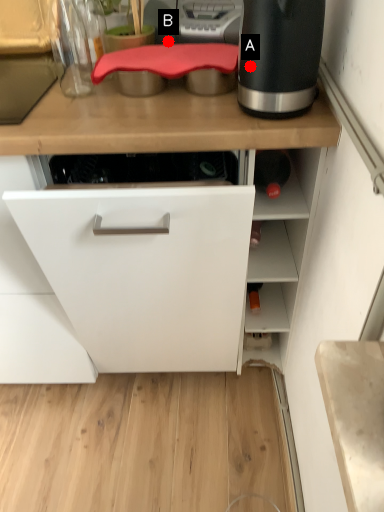
Question: Two points are circled on the image, labeled by A and B beside each circle. Which point is further to the camera?

Choices:
 (A) A is further
 (B) B is further

Answer: (B)